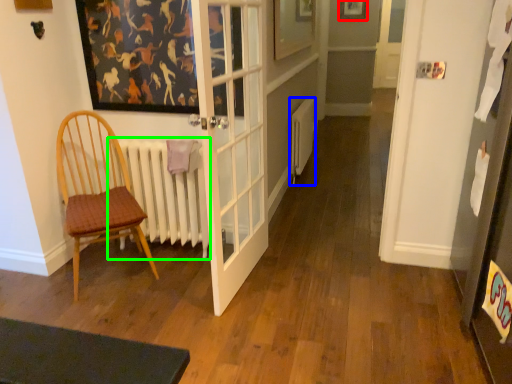
Question: Which is farther away from picture frame (highlighted by a red box)? heater (highlighted by a blue box) or radiator (highlighted by a green box)?

Choices:
 (A) heater
 (B) radiator

Answer: (B)